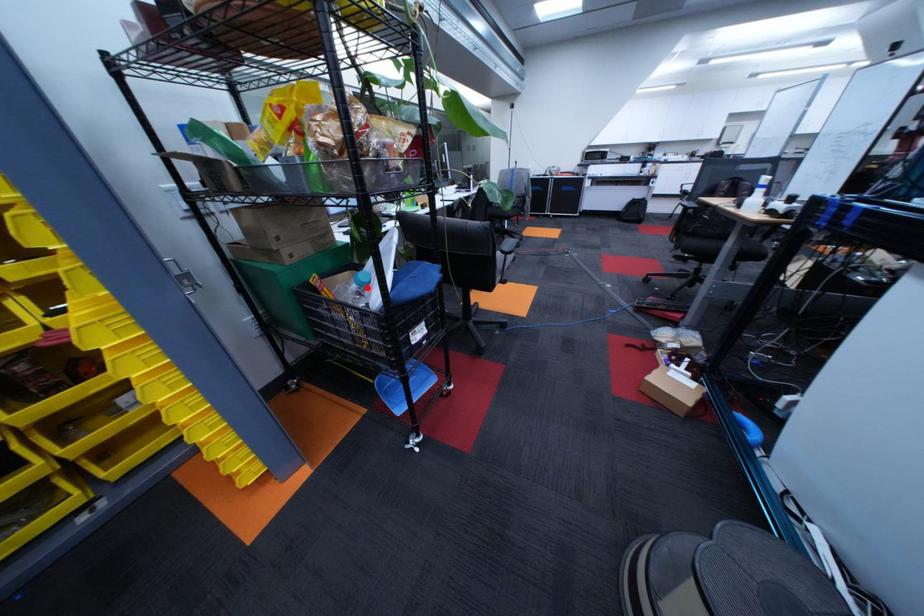
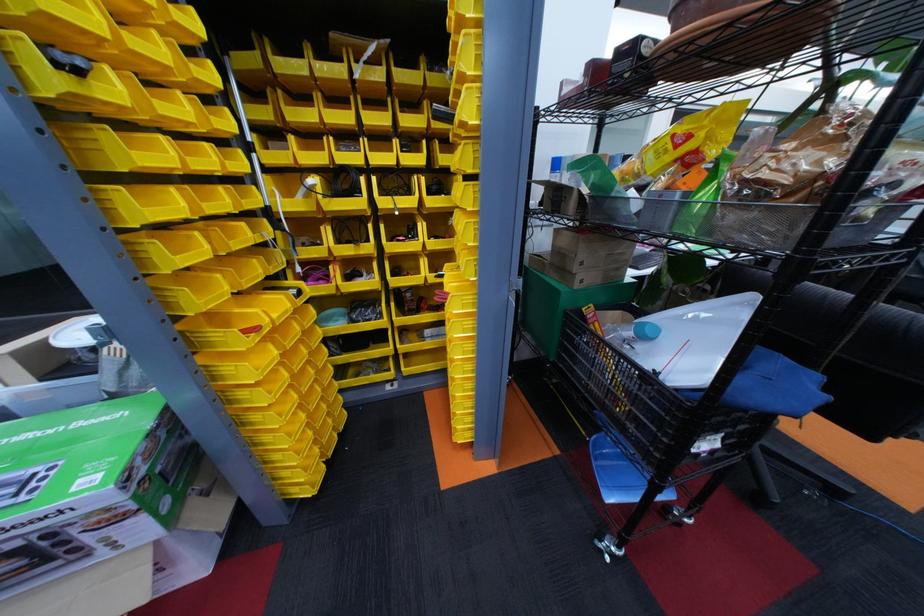
Find the pixel in the second image that matches the highlighted location in the first image.

(641, 334)